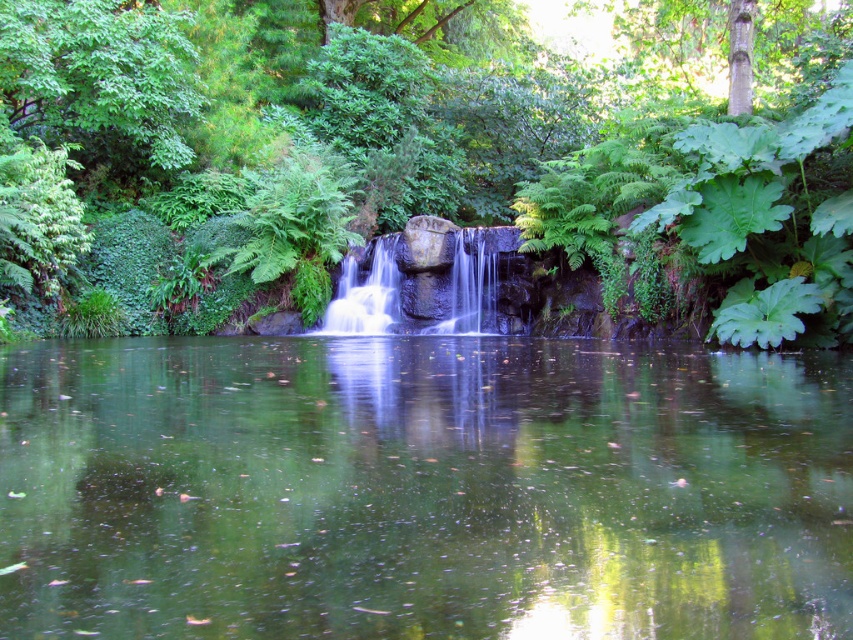
Question: Which point is farther from the camera taking this photo?

Choices:
 (A) (759, 369)
 (B) (461, 288)

Answer: (B)

Question: Does green leafy tree at center lie behind white smooth waterfall at center?

Choices:
 (A) no
 (B) yes

Answer: (A)

Question: Where is green leafy tree at center located in relation to white smooth waterfall at center in the image?

Choices:
 (A) right
 (B) left

Answer: (A)

Question: Among these points, which one is nearest to the camera?

Choices:
 (A) (421, 630)
 (B) (32, 45)
 (C) (462, 259)

Answer: (A)

Question: Which of these objects is positioned closest to the green leafy tree at center?

Choices:
 (A) white smooth waterfall at center
 (B) green reflective water at center

Answer: (A)

Question: Does green reflective water at center appear under green leafy tree at center?

Choices:
 (A) no
 (B) yes

Answer: (B)